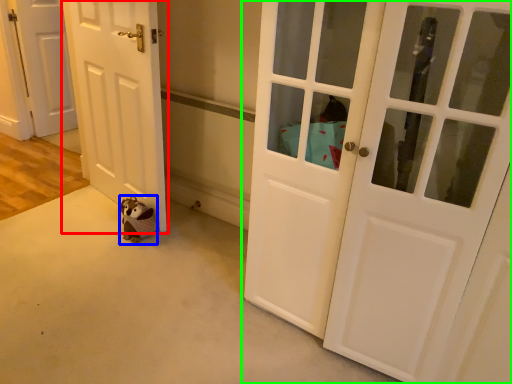
Question: Which object is the closest to the door (highlighted by a red box)? Choose among these: animal (highlighted by a blue box) or door (highlighted by a green box).

Choices:
 (A) animal
 (B) door

Answer: (A)